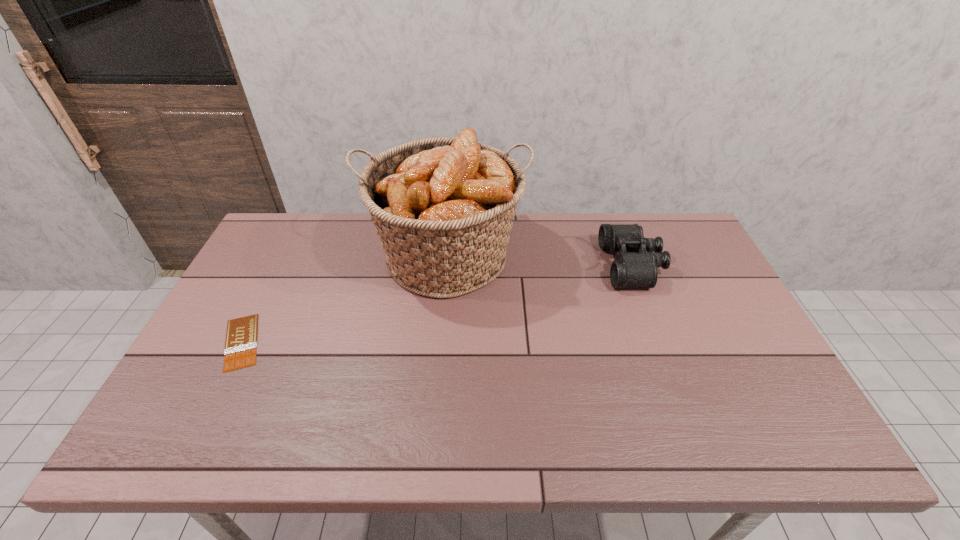
Where is `basket`? The width and height of the screenshot is (960, 540). basket is located at coordinates (443, 208).

What are the coordinates of `the second object from right to left` in the screenshot? It's located at (443, 208).

Identify the location of the second shortest object. The height and width of the screenshot is (540, 960). (635, 265).

Where is `binoculars`? This screenshot has width=960, height=540. binoculars is located at coordinates (635, 265).

The image size is (960, 540). What are the coordinates of `the shortest object` in the screenshot? It's located at (240, 351).

Locate an element on the screen. the nearest object is located at coordinates (240, 351).

Identify the location of free space located 0.340m on the front of the tallest object. (432, 420).

Find the location of `free region located at the eyepieces of the second shortest object`. free region located at the eyepieces of the second shortest object is located at coordinates (506, 265).

At what (x,y) coordinates should I click in order to perform the action: click on vacant area situated 0.400m at the eyepieces of the second shortest object. Please return your answer as a coordinate pair (x, y). This screenshot has width=960, height=540. Looking at the image, I should click on (478, 265).

The image size is (960, 540). Identify the location of blank area located at the eyepieces of the second shortest object. (493, 265).